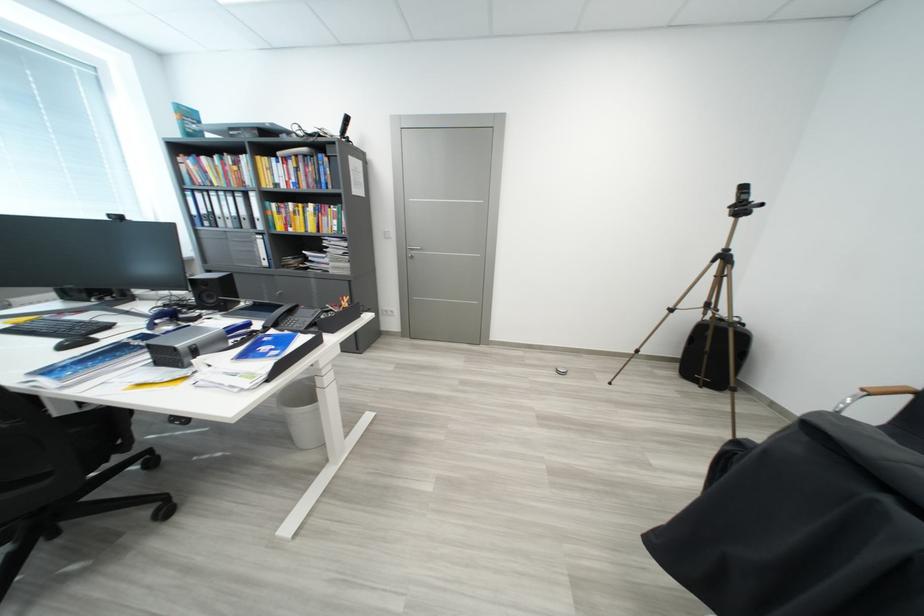
Describe the element at coordinates (280, 314) in the screenshot. The image size is (924, 616). I see `the telephone handset` at that location.